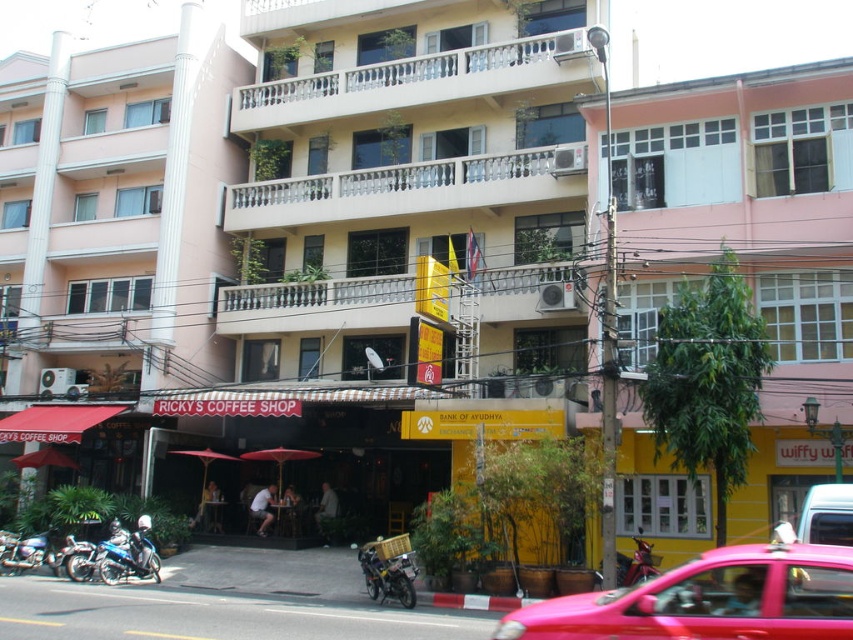
Does pink matte car at center appear over metallic blue motorcycle at lower left?

Yes, pink matte car at center is above metallic blue motorcycle at lower left.

I want to click on pink matte car at center, so click(827, 515).

Where is `pink matte car at center`? Image resolution: width=853 pixels, height=640 pixels. pink matte car at center is located at coordinates (827, 515).

Is metallic silver motorcycle at lower center thinner than pink matte car at center?

No.

Between metallic silver motorcycle at lower center and pink matte car at center, which one is positioned lower?

Positioned lower is metallic silver motorcycle at lower center.

Locate an element on the screen. metallic silver motorcycle at lower center is located at coordinates (387, 568).

Is pink matte building at center further to camera compared to pink matte car at center?

Yes, pink matte building at center is further from the viewer.

Between pink matte building at center and pink matte car at center, which one has less height?

Standing shorter between the two is pink matte car at center.

Describe the element at coordinates (747, 241) in the screenshot. This screenshot has width=853, height=640. I see `pink matte building at center` at that location.

Where is `pink matte building at center`? This screenshot has width=853, height=640. pink matte building at center is located at coordinates (747, 241).